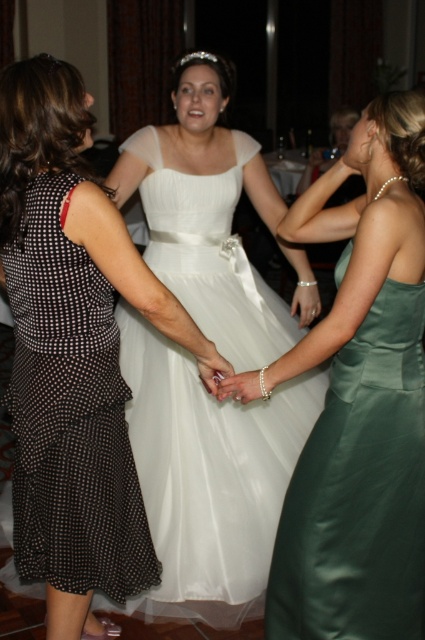
Question: Which object appears closest to the camera in this image?

Choices:
 (A) black dotted fabric dress at left
 (B) white satin dress at center
 (C) white tulle dress at center

Answer: (A)

Question: Does white satin dress at center have a smaller size compared to white tulle dress at center?

Choices:
 (A) no
 (B) yes

Answer: (B)

Question: Which of the following is the farthest from the observer?

Choices:
 (A) (93, 413)
 (B) (342, 600)

Answer: (B)

Question: Which object appears closest to the camera in this image?

Choices:
 (A) white satin dress at center
 (B) white tulle dress at center

Answer: (A)

Question: Does white tulle dress at center appear over black dotted fabric dress at left?

Choices:
 (A) no
 (B) yes

Answer: (B)

Question: Can you confirm if white satin dress at center is wider than black dotted fabric dress at left?

Choices:
 (A) no
 (B) yes

Answer: (B)